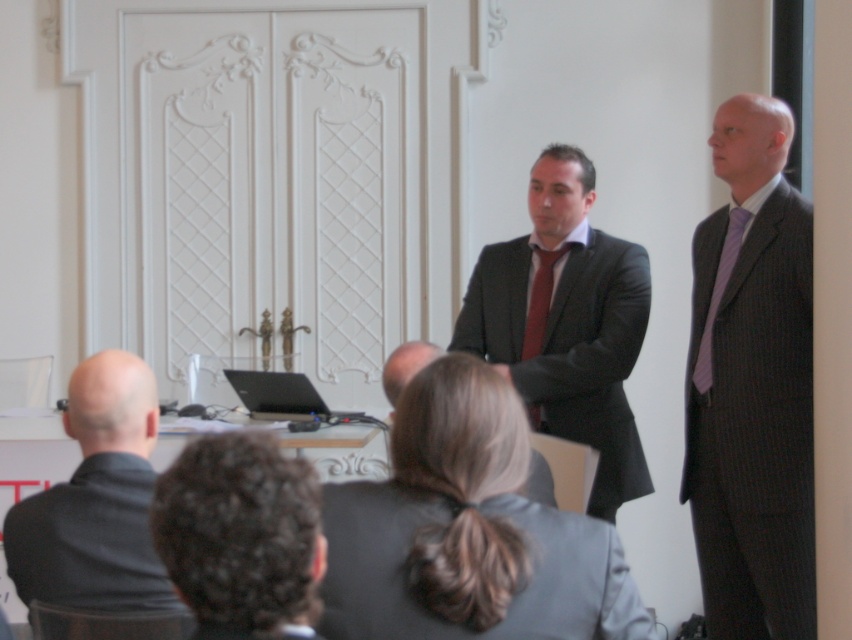
You are a photographer in the audience taking a picture of the speakers. You notice the curly hair at lower left and the matte red tie at center. Which object is positioned lower in the frame?

The curly hair at lower left is located below the matte red tie at center, so it is positioned lower in the frame.

You are a photographer trying to capture a photo of both the dark gray checkered suit at right and the curly hair at lower left. Since you want to ensure both are clearly visible, which object should you focus on first, considering their sizes?

The dark gray checkered suit at right is bigger than curly hair at lower left, so you should focus on the dark gray checkered suit at right first to ensure clarity.

You are standing in the audience facing the two men in suits. There are two points marked in the scene. Point A is at coordinates point [285,632] and Point B is at coordinates point [545,262]. Which point is closer to you?

Point A at point [285,632] is closer to you because it is in front of Point B at point [545,262].